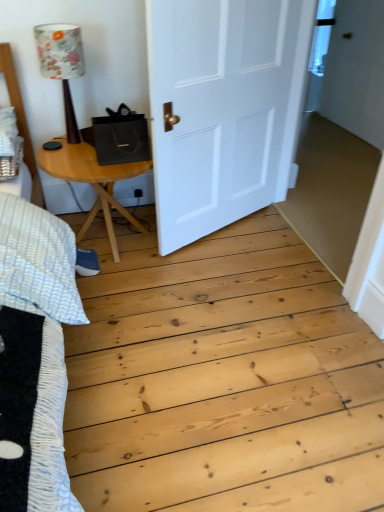
Measure the distance between point (270, 10) and camera.

Point (270, 10) and camera are 6.55 feet apart from each other.

Where is `floral fabric lampshade at upper left`? floral fabric lampshade at upper left is located at coordinates (62, 64).

From the image's perspective, which is below, floral fabric lampshade at upper left or light brown wooden table at left?

light brown wooden table at left appears lower in the image.

From a real-world perspective, which is physically below, floral fabric lampshade at upper left or light brown wooden table at left?

light brown wooden table at left.

Is floral fabric lampshade at upper left thinner than light brown wooden table at left?

Yes.

Which is correct: floral fabric lampshade at upper left is inside light brown wooden table at left, or outside of it?

floral fabric lampshade at upper left is located beyond the bounds of light brown wooden table at left.

Is floral fabric lampshade at upper left located within white matte door at center?

Definitely not — floral fabric lampshade at upper left is not inside white matte door at center.

Considering the positions of point (285, 45) and point (64, 90), is point (285, 45) closer or farther from the camera than point (64, 90)?

Point (285, 45) is positioned farther from the camera compared to point (64, 90).

Which object is further away from the camera, white matte door at center or floral fabric lampshade at upper left?

floral fabric lampshade at upper left.

Would you say light brown wooden table at left contains floral fabric lampshade at upper left?

No, light brown wooden table at left does not contain floral fabric lampshade at upper left.

Considering the points (85, 146) and (62, 80), which point is behind, point (85, 146) or point (62, 80)?

The point (85, 146) is farther.

From the image's perspective, who appears lower, light brown wooden table at left or floral fabric lampshade at upper left?

light brown wooden table at left is shown below in the image.

Are light brown wooden table at left and floral fabric lampshade at upper left making contact?

No, light brown wooden table at left is not with floral fabric lampshade at upper left.

Which is more distant, [64,47] or [227,53]?

Positioned behind is point [227,53].

Is floral fabric lampshade at upper left facing towards white matte door at center?

No, floral fabric lampshade at upper left is not facing towards white matte door at center.

Are floral fabric lampshade at upper left and white matte door at center located far from each other?

No, floral fabric lampshade at upper left is in close proximity to white matte door at center.

Considering the sizes of objects floral fabric lampshade at upper left and white matte door at center in the image provided, who is smaller, floral fabric lampshade at upper left or white matte door at center?

floral fabric lampshade at upper left.

Which is in front, point (90, 146) or point (303, 42)?

The point (90, 146) is closer.

Which of these two, light brown wooden table at left or white matte door at center, stands shorter?

light brown wooden table at left is shorter.

From the image's perspective, is light brown wooden table at left above or below white matte door at center?

light brown wooden table at left is situated lower than white matte door at center in the image.

Considering the sizes of light brown wooden table at left and white matte door at center in the image, is light brown wooden table at left wider or thinner than white matte door at center?

Considering their sizes, light brown wooden table at left looks broader than white matte door at center.

From the picture: Is white matte door at center facing towards light brown wooden table at left?

No, white matte door at center is not turned towards light brown wooden table at left.

Considering the sizes of objects white matte door at center and light brown wooden table at left in the image provided, who is smaller, white matte door at center or light brown wooden table at left?

Smaller between the two is white matte door at center.

Is white matte door at center not close to light brown wooden table at left?

They are positioned close to each other.

From the image's perspective, is white matte door at center located beneath light brown wooden table at left?

No, from the image's perspective, white matte door at center is not below light brown wooden table at left.

The height and width of the screenshot is (512, 384). In order to click on lamp that is above the light brown wooden table at left (from a real-world perspective) in this screenshot , I will do `click(62, 64)`.

You are a GUI agent. You are given a task and a screenshot of the screen. Output one action in this format:
    pyautogui.click(x=<x>, y=<y>)
    Task: Click on the door in front of the floral fabric lampshade at upper left
    
    Given the screenshot: What is the action you would take?
    pyautogui.click(x=223, y=108)

Considering their positions, is white matte door at center positioned closer to light brown wooden table at left than floral fabric lampshade at upper left?

floral fabric lampshade at upper left is closer to light brown wooden table at left.

Based on their spatial positions, is floral fabric lampshade at upper left or white matte door at center further from light brown wooden table at left?

white matte door at center lies further to light brown wooden table at left than the other object.

Which object lies further to the anchor point floral fabric lampshade at upper left, light brown wooden table at left or white matte door at center?

Based on the image, white matte door at center appears to be further to floral fabric lampshade at upper left.

Considering their positions, is light brown wooden table at left positioned further to white matte door at center than floral fabric lampshade at upper left?

floral fabric lampshade at upper left lies further to white matte door at center than the other object.

Estimate the real-world distances between objects in this image. Which object is further from floral fabric lampshade at upper left, white matte door at center or light brown wooden table at left?

white matte door at center lies further to floral fabric lampshade at upper left than the other object.

Looking at the image, which one is located further to white matte door at center, floral fabric lampshade at upper left or light brown wooden table at left?

Based on the image, floral fabric lampshade at upper left appears to be further to white matte door at center.

Identify the location of table between floral fabric lampshade at upper left and white matte door at center in the horizontal direction. This screenshot has width=384, height=512. (93, 181).